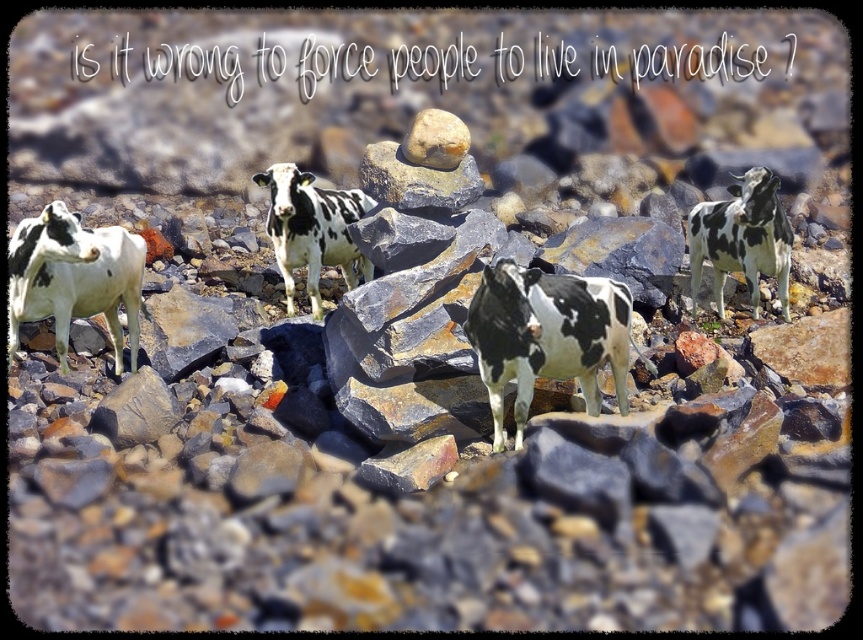
You are a photographer standing at the center of the rocky landscape. You want to take a photo of the white and black spotted cow at left. Where should you aim your camera to capture it in the frame?

The white and black spotted cow at left is located at the 2D coordinates point (74, 278), so you should aim your camera towards that point to capture it in the frame.